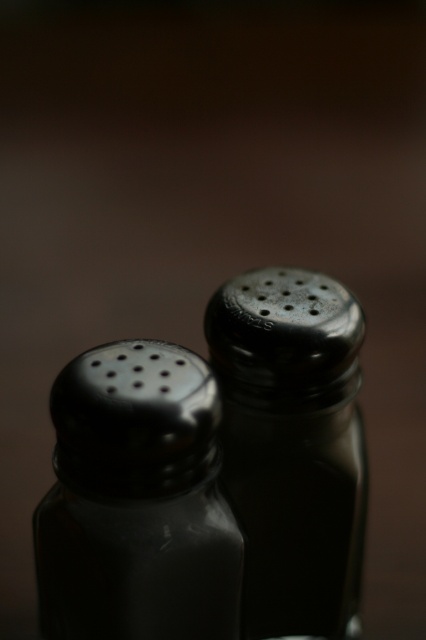
You are setting up a table for a dinner party and need to place the satin black salt shaker at center and the satin black pepper shaker at center in a specific order. If you want to place the taller one to the left of the shorter one, which shaker should go on the left?

The satin black pepper shaker at center is taller than the satin black salt shaker at center, so you should place the satin black pepper shaker at center on the left side.

You are setting the table and notice two satin black shakers at center. Which one is positioned lower between the satin black salt shaker at center and the satin black pepper shaker at center?

The satin black salt shaker at center is positioned below the satin black pepper shaker at center, so the salt shaker is lower.